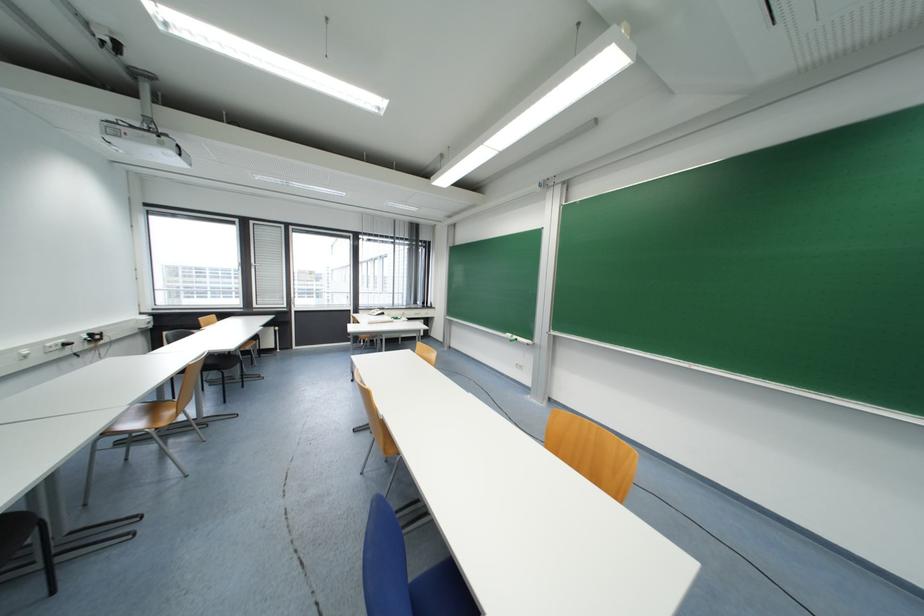
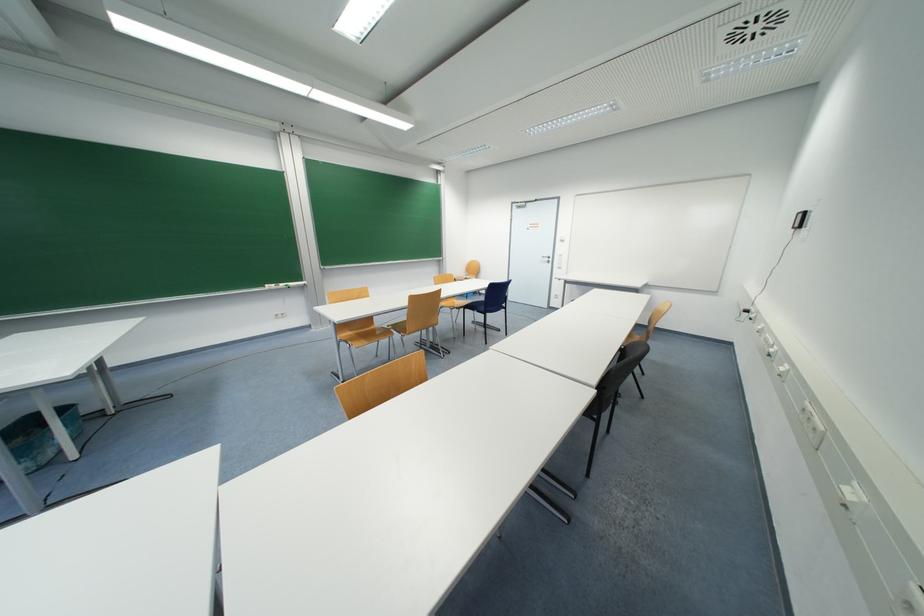
In the second image, find the point that corresponds to pixel 519 339 in the first image.

(286, 286)